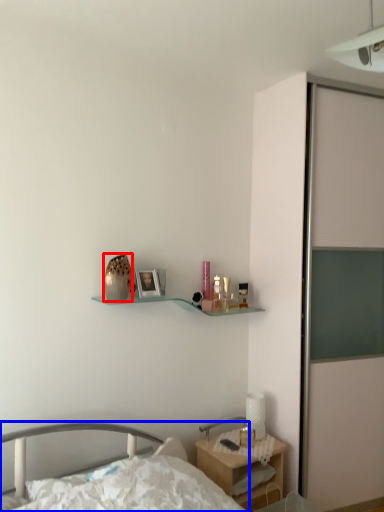
Question: Which object appears closest to the camera in this image, vase (highlighted by a red box) or bed (highlighted by a blue box)?

Choices:
 (A) vase
 (B) bed

Answer: (B)